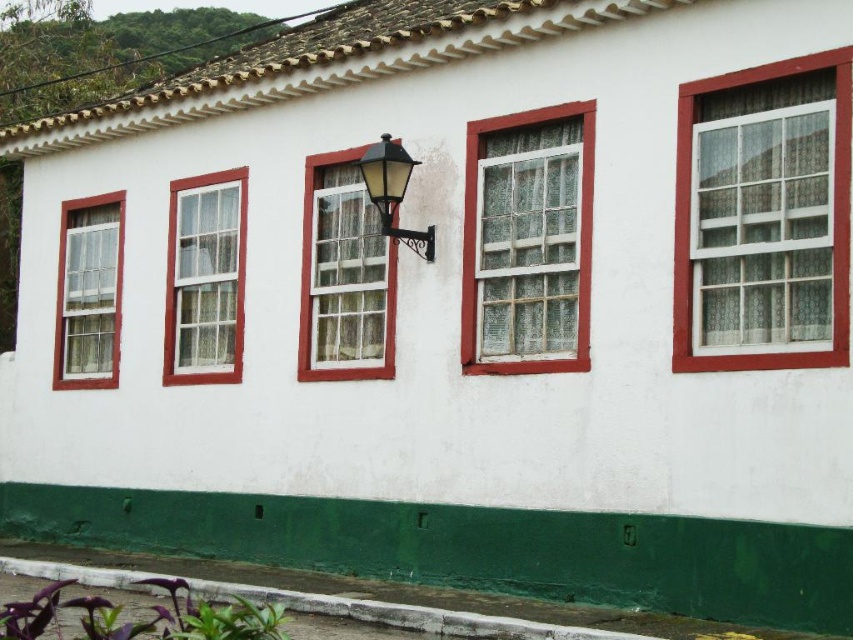
Between point (178, 314) and point (374, 144), which one is positioned in front?

Point (374, 144)

The height and width of the screenshot is (640, 853). I want to click on white glass window at center left, so click(206, 278).

Does point (169, 196) come farther from viewer compared to point (97, 323)?

No, it is in front of (97, 323).

How distant is white glass window at center left from white glass window at left?

A distance of 5.93 feet exists between white glass window at center left and white glass window at left.

Which is behind, point (223, 305) or point (107, 369)?

The point (107, 369) is behind.

Where is `white glass window at center left`? The height and width of the screenshot is (640, 853). white glass window at center left is located at coordinates (206, 278).

Does white textured glass window at center have a smaller size compared to white glass window at left?

Incorrect, white textured glass window at center is not smaller in size than white glass window at left.

Which is more to the left, white textured glass window at center or white glass window at left?

white glass window at left

Between point (570, 362) and point (113, 196), which one is positioned behind?

The point (113, 196) is more distant.

Locate an element on the screen. The image size is (853, 640). white textured glass window at center is located at coordinates (527, 241).